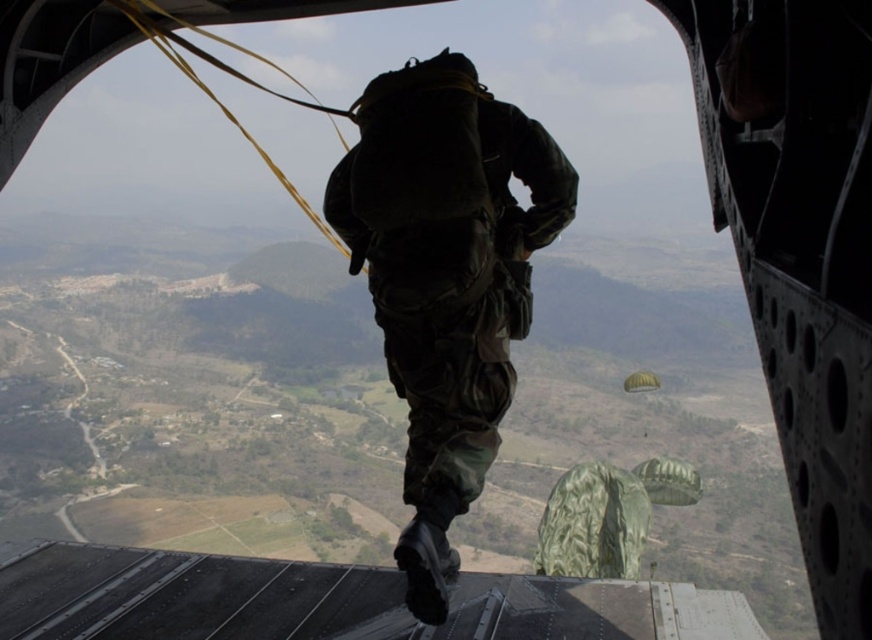
Question: Where is camo fabric uniform at center located in relation to green fabric parachute at lower center in the image?

Choices:
 (A) left
 (B) right

Answer: (A)

Question: Which point appears farthest from the camera in this image?

Choices:
 (A) (639, 380)
 (B) (390, 244)

Answer: (A)

Question: Does camo fabric uniform at center appear over green fabric parachute at lower center?

Choices:
 (A) no
 (B) yes

Answer: (B)

Question: Can you confirm if camo fabric uniform at center is positioned to the left of green fabric parachute at lower center?

Choices:
 (A) no
 (B) yes

Answer: (B)

Question: Which point is closer to the camera?

Choices:
 (A) (419, 160)
 (B) (627, 380)

Answer: (A)